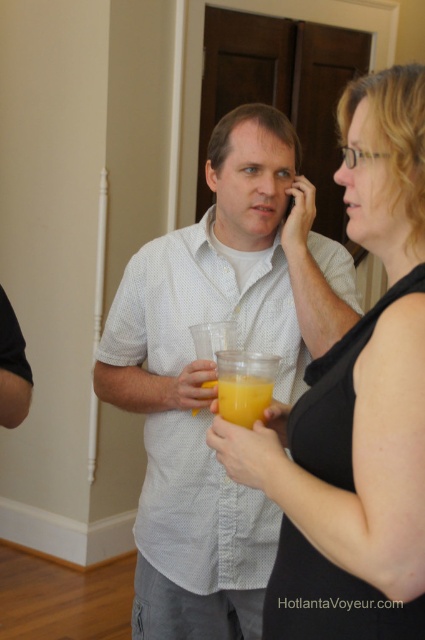
You are a bartender at a party and need to place a drink between the white dotted shirt at center and the translucent plastic cup at center. The minimum distance required between drinks is 50 centimeters for safety. Can you place the drink there?

The white dotted shirt at center is 46.18 centimeters away from the translucent plastic cup at center. Since the required distance is 50 centimeters, placing a drink between them would violate the safety requirement.

You are a bartender at a party and need to place a black matte tank top at center and a translucent plastic cup at center on a shelf. The shelf is only 10 inches wide. Can both items fit side by side on the shelf without overlapping?

The black matte tank top at center is 10.44 inches from the translucent plastic cup at center. Since the distance between them is greater than the shelf width of 10 inches, they cannot fit side by side without overlapping.

You are at a party and want to hand a gift to the person wearing the black matte tank top at center without disturbing the person holding the translucent plastic cup at center. Which direction should you approach from?

You should approach from the left side of the translucent plastic cup at center because the black matte tank top at center is to the right of it, so approaching from the left would allow you to reach the black matte tank top at center without getting too close to the person holding the translucent plastic cup at center.